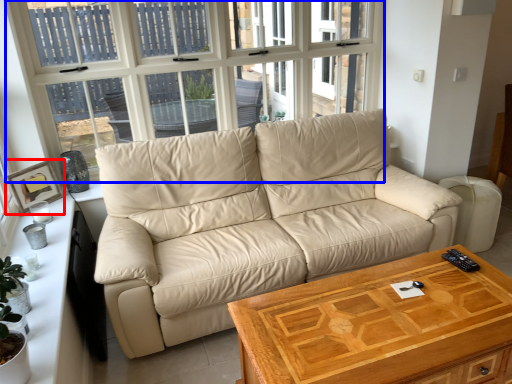
Question: Which object appears closest to the camera in this image, picture frame (highlighted by a red box) or window (highlighted by a blue box)?

Choices:
 (A) picture frame
 (B) window

Answer: (B)